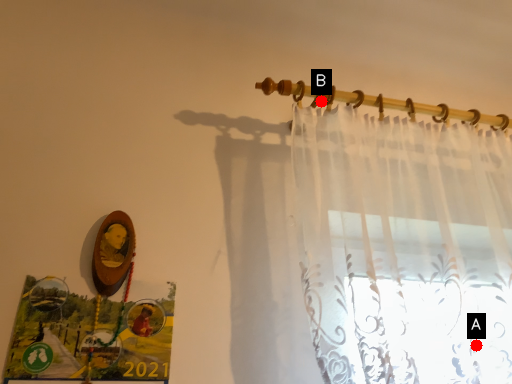
Question: Two points are circled on the image, labeled by A and B beside each circle. Which of the following is the closest to the observer?

Choices:
 (A) A is closer
 (B) B is closer

Answer: (A)